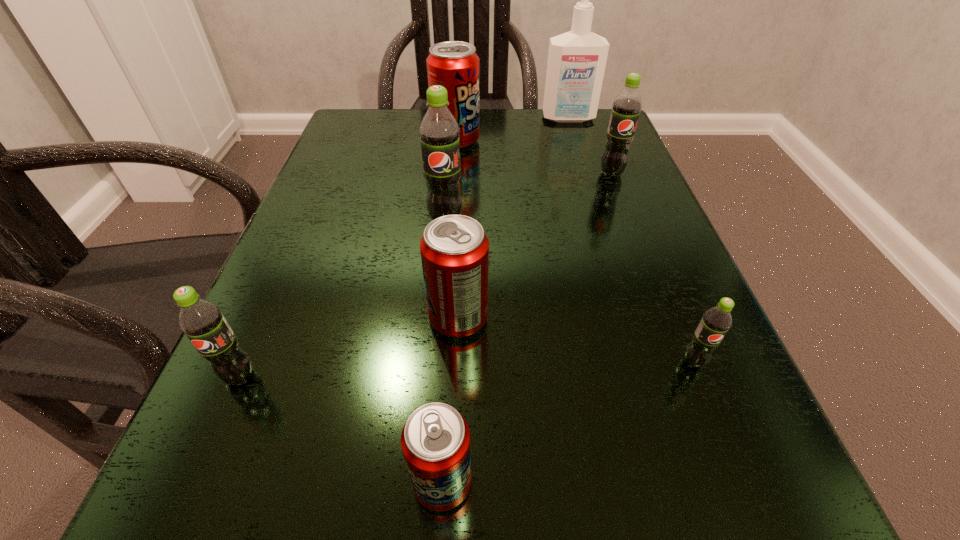
Find the location of `unoccupied area between the nearest object and the farthest object`. unoccupied area between the nearest object and the farthest object is located at coordinates (506, 300).

Where is `free space between the leftmost green soda and the second smallest red soda can`? free space between the leftmost green soda and the second smallest red soda can is located at coordinates (348, 347).

At what (x,y) coordinates should I click in order to perform the action: click on the sixth closest object to the second smallest green soda. Please return your answer as a coordinate pair (x, y). The image size is (960, 540). Looking at the image, I should click on (626, 107).

Locate an element on the screen. The image size is (960, 540). object that stands as the fourth closest to the seventh shortest object is located at coordinates (202, 321).

In order to click on soda can that stands as the third closest to the second smallest red soda can in this screenshot , I will do `click(202, 321)`.

Select which soda can appears as the third closest to the smallest red soda can. Please provide its 2D coordinates. Your answer should be formatted as a tuple, i.e. [(x, y)], where the tuple contains the x and y coordinates of a point satisfying the conditions above.

[(717, 320)]

Select which green soda appears as the closest to the fourth farthest object. Please provide its 2D coordinates. Your answer should be formatted as a tuple, i.e. [(x, y)], where the tuple contains the x and y coordinates of a point satisfying the conditions above.

[(626, 107)]

This screenshot has width=960, height=540. Identify the location of the third closest green soda to the smallest green soda. (202, 321).

At what (x,y) coordinates should I click in order to perform the action: click on the second closest red soda can to the leftmost green soda. Please return your answer as a coordinate pair (x, y). Looking at the image, I should click on (435, 440).

Identify the location of red soda can that is the third closest to the cleansing agent. pos(435,440).